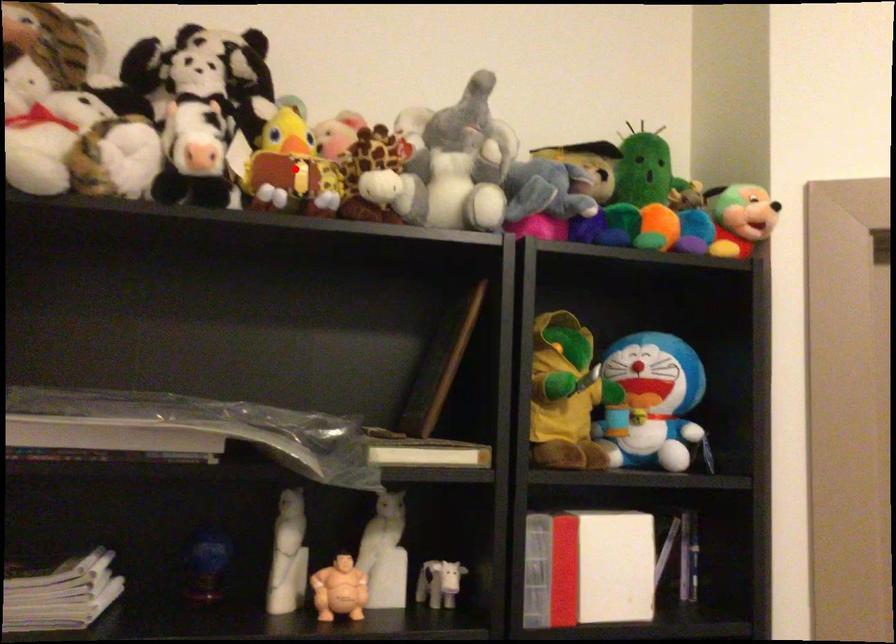
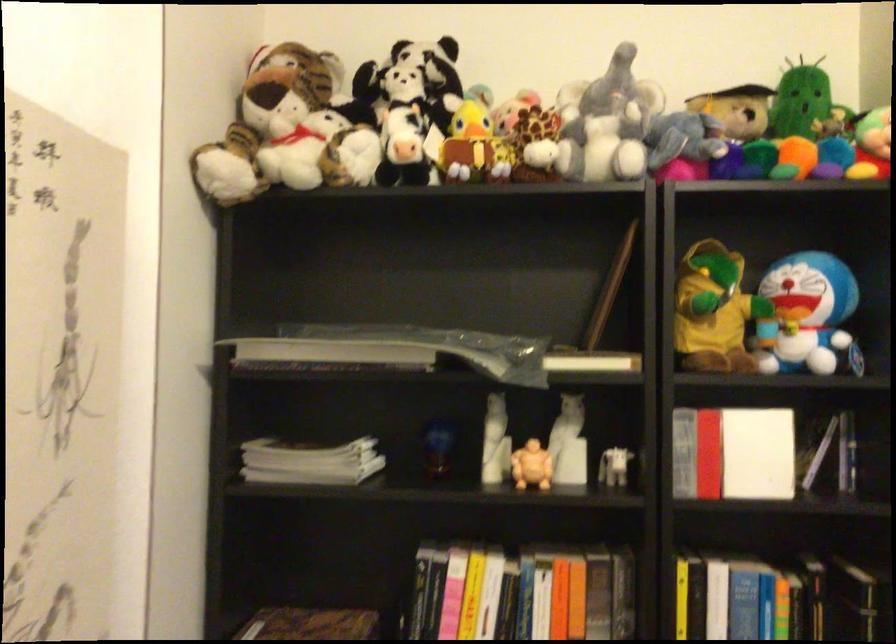
Where in the second image is the point corresponding to the highlighted location from the first image?

(475, 146)